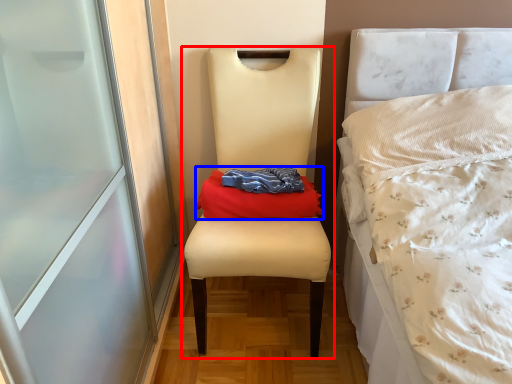
Question: Which object is further to the camera taking this photo, chair (highlighted by a red box) or material (highlighted by a blue box)?

Choices:
 (A) chair
 (B) material

Answer: (B)